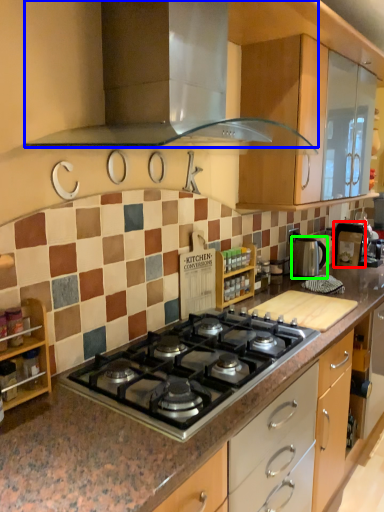
Question: Which object is positioned closest to appliance (highlighted by a red box)? Select from home appliance (highlighted by a blue box) and kitchen appliance (highlighted by a green box).

Choices:
 (A) home appliance
 (B) kitchen appliance

Answer: (B)